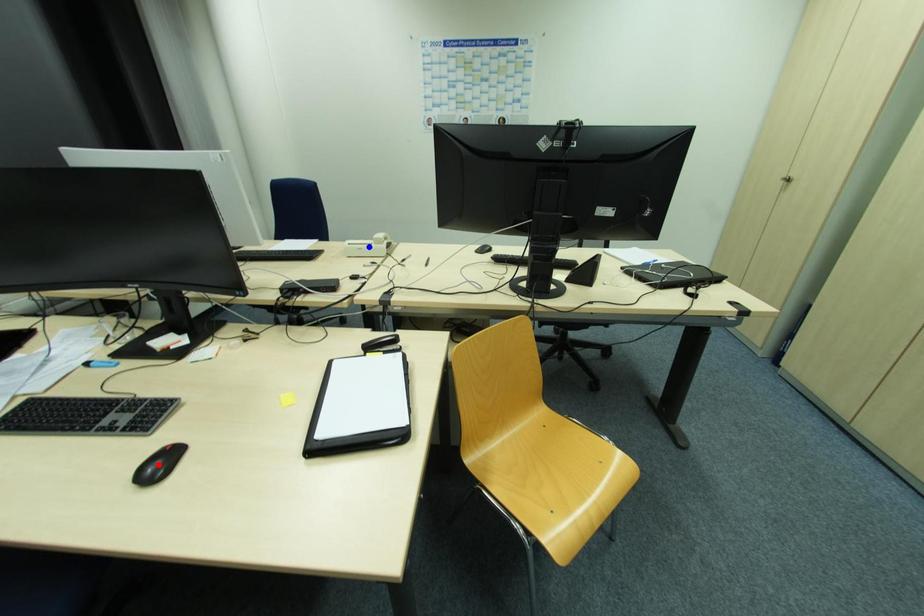
Question: In the image, two points are highlighted. Which point is nearer to the camera? Reply with the corresponding letter.

Choices:
 (A) blue point
 (B) red point

Answer: (B)